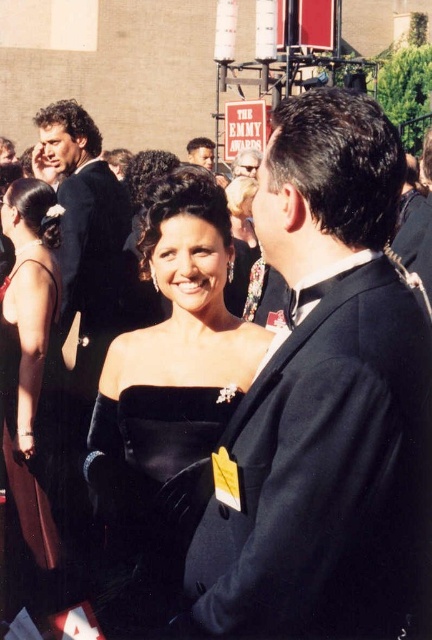
Question: Which object is the closest to the brown satin dress at left?

Choices:
 (A) black satin dress at center
 (B) shiny black suit at left

Answer: (B)

Question: Which object is farther from the camera taking this photo?

Choices:
 (A) brown satin dress at left
 (B) black satin dress at center
 (C) shiny black suit at left

Answer: (C)

Question: Can you confirm if velvet black dress at center is wider than shiny black suit at left?

Choices:
 (A) yes
 (B) no

Answer: (A)

Question: Which point is farther to the camera?

Choices:
 (A) black satin suit at center
 (B) shiny black suit at left
 (C) black satin dress at center

Answer: (B)

Question: Is velvet black dress at center bigger than dark brown hair at center?

Choices:
 (A) yes
 (B) no

Answer: (B)

Question: Is black satin dress at center behind brown satin dress at left?

Choices:
 (A) yes
 (B) no

Answer: (B)